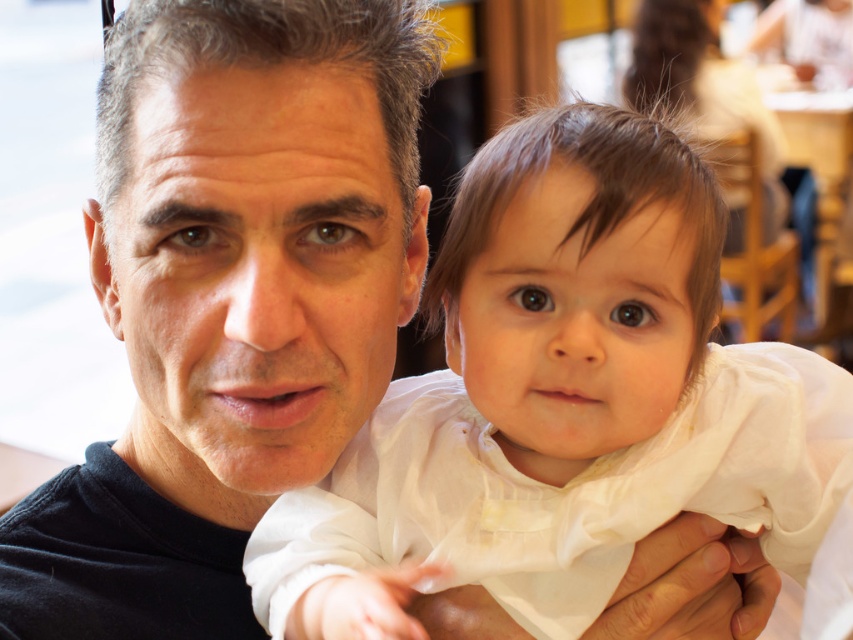
Is white silky dress at center further to the viewer compared to black matte shirt at center?

No, white silky dress at center is closer to the viewer.

Who is more forward, (743, 456) or (289, 442)?

Point (289, 442) is in front.

Image resolution: width=853 pixels, height=640 pixels. In order to click on white silky dress at center in this screenshot , I will do `click(561, 403)`.

Where is `white silky dress at center`? The height and width of the screenshot is (640, 853). white silky dress at center is located at coordinates pyautogui.click(x=561, y=403).